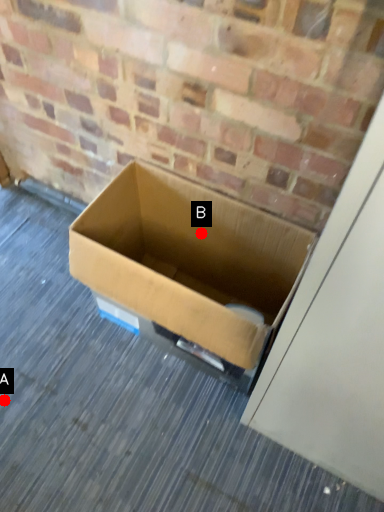
Question: Two points are circled on the image, labeled by A and B beside each circle. Which point appears farthest from the camera in this image?

Choices:
 (A) A is further
 (B) B is further

Answer: (B)